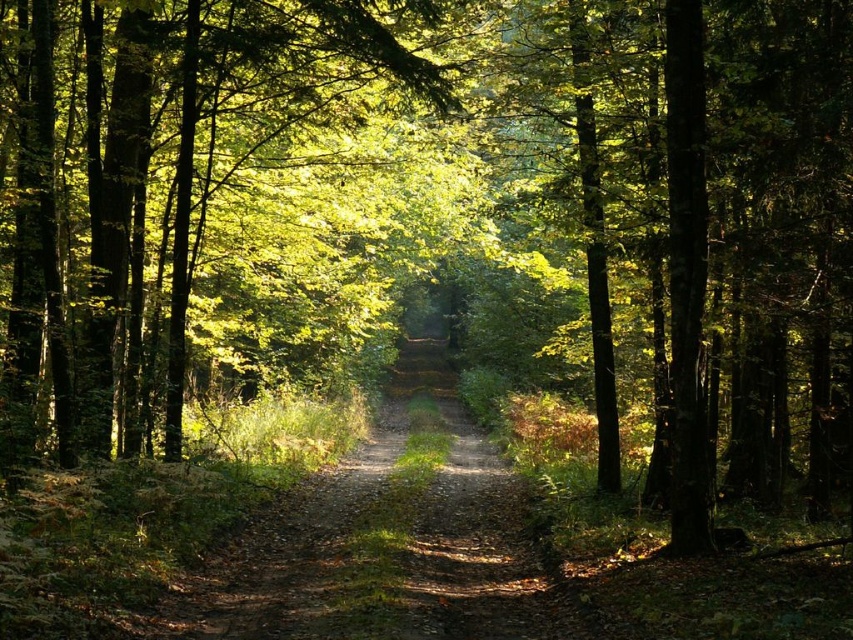
Does green leafy tree at center have a greater width compared to dirt path at center?

Yes, green leafy tree at center is wider than dirt path at center.

Does green leafy tree at center have a larger size compared to dirt path at center?

Yes, green leafy tree at center is bigger than dirt path at center.

Who is more forward, (13, 52) or (404, 556)?

Point (404, 556) is in front.

You are a GUI agent. You are given a task and a screenshot of the screen. Output one action in this format:
    pyautogui.click(x=<x>, y=<y>)
    Task: Click on the green leafy tree at center
    The width and height of the screenshot is (853, 640).
    Given the screenshot: What is the action you would take?
    pyautogui.click(x=192, y=186)